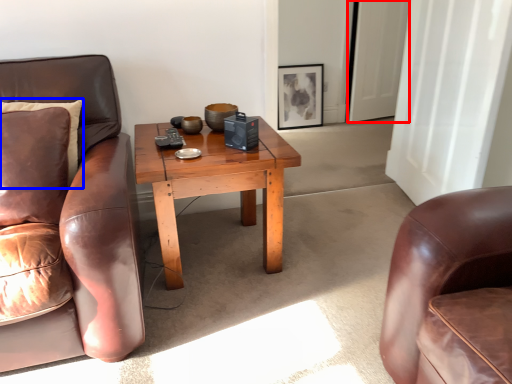
Question: Which object is further to the camera taking this photo, glass door (highlighted by a red box) or pillow (highlighted by a blue box)?

Choices:
 (A) glass door
 (B) pillow

Answer: (A)